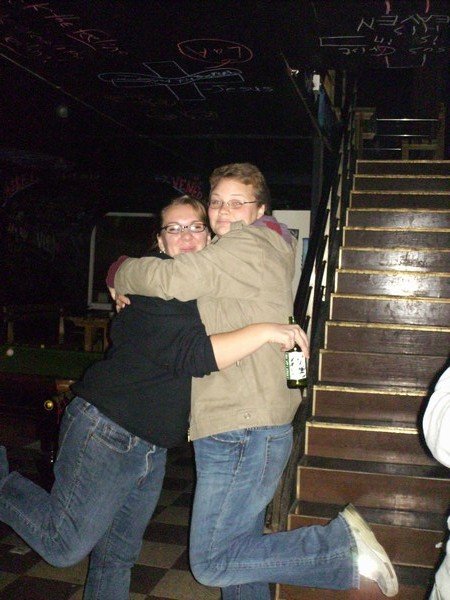
In order to click on wooden staircase in this screenshot , I will do `click(397, 356)`.